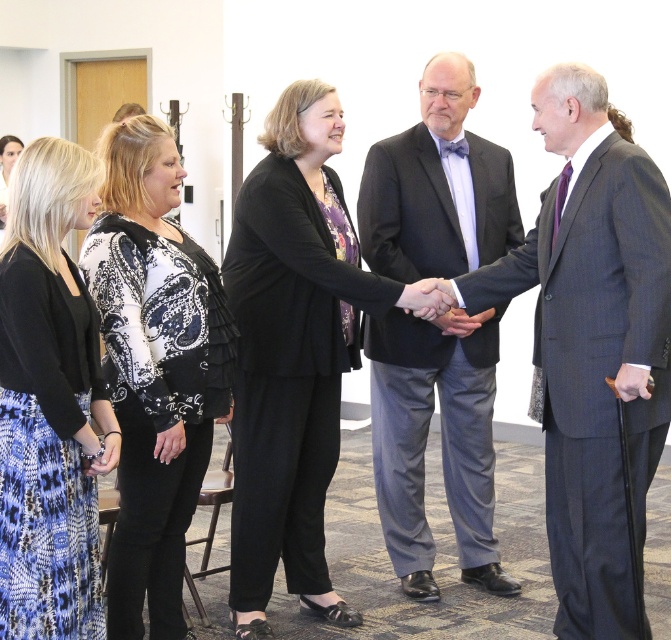
Question: Can you confirm if dark gray pinstripe suit at right is positioned above printed fabric skirt at lower left?

Choices:
 (A) no
 (B) yes

Answer: (A)

Question: Which point is closer to the camera taking this photo?

Choices:
 (A) (136, 220)
 (B) (431, 193)
 (C) (311, 113)
 (D) (415, 284)

Answer: (A)

Question: Does dark gray pinstripe suit at right have a lesser width compared to black paisley blouse at center?

Choices:
 (A) yes
 (B) no

Answer: (B)

Question: From the image, what is the correct spatial relationship of dark gray pinstripe suit at right in relation to dark gray suit at center?

Choices:
 (A) below
 (B) above

Answer: (A)

Question: Which of the following is the farthest from the observer?

Choices:
 (A) dark gray suit at center
 (B) printed fabric skirt at lower left
 (C) black fabric suit at center

Answer: (A)

Question: Which object appears farthest from the camera in this image?

Choices:
 (A) black paisley blouse at center
 (B) smooth black hand at center
 (C) black fabric suit at center
 (D) dark gray suit at center

Answer: (D)